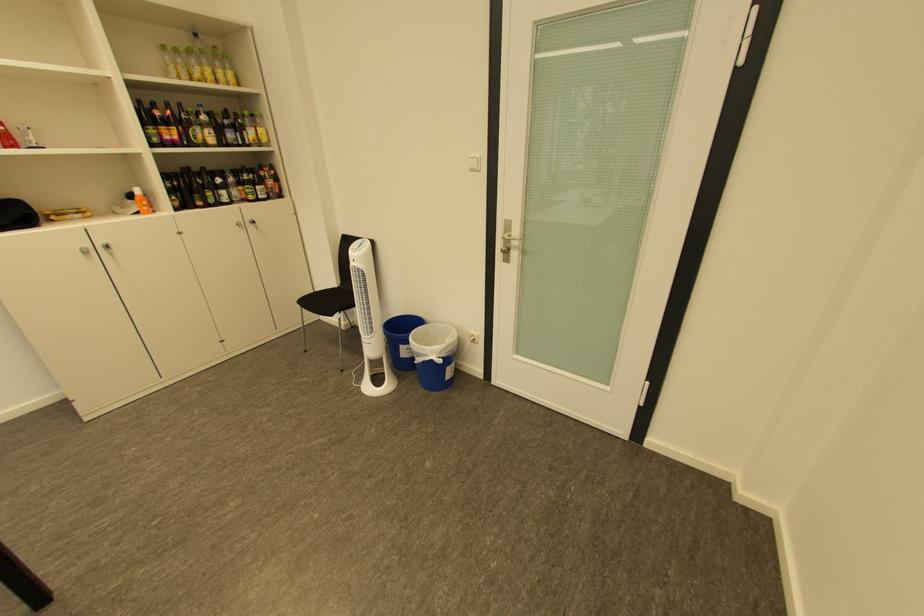
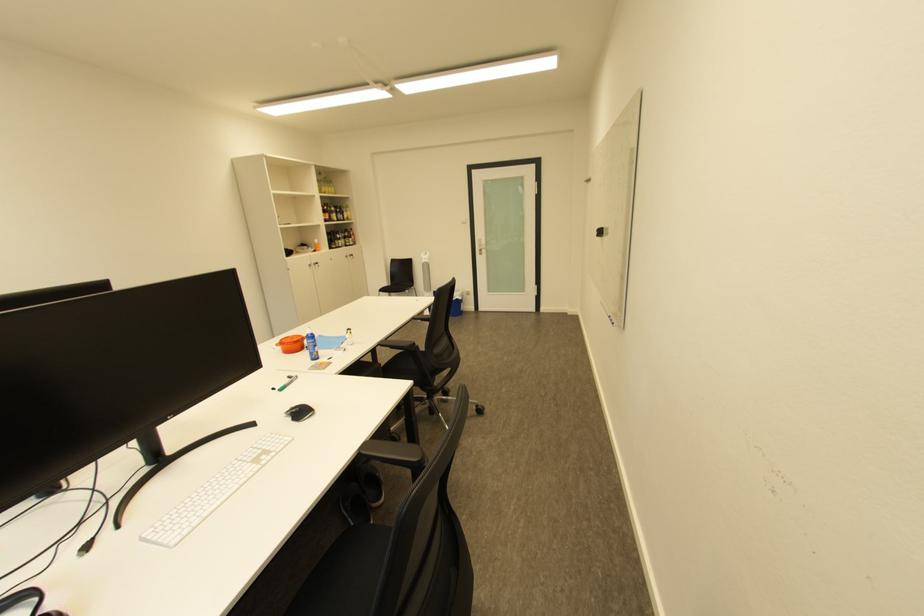
Where in the second image is the point corresponding to the point at 165,156 from the first image?

(335, 225)